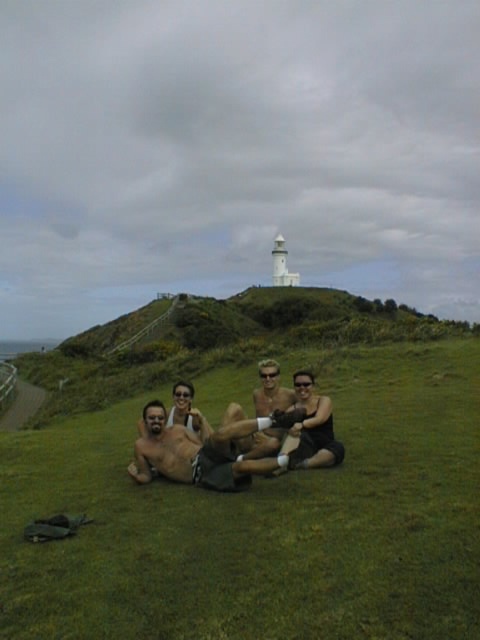
Question: Which is nearer to the black fabric shorts at center?

Choices:
 (A) green grassy hillside at upper center
 (B) green grassy at center

Answer: (B)

Question: Is shiny metallic shorts at center above black fabric shorts at center?

Choices:
 (A) yes
 (B) no

Answer: (B)

Question: Which point is farther from the camera taking this photo?

Choices:
 (A) (169, 584)
 (B) (310, 371)

Answer: (B)

Question: From the image, what is the correct spatial relationship of green grassy at center in relation to black fabric shorts at center?

Choices:
 (A) right
 (B) left

Answer: (B)

Question: Which of the following is the closest to the observer?

Choices:
 (A) (104, 346)
 (B) (133, 612)

Answer: (B)

Question: Is green grassy at center wider than black fabric shorts at center?

Choices:
 (A) yes
 (B) no

Answer: (A)